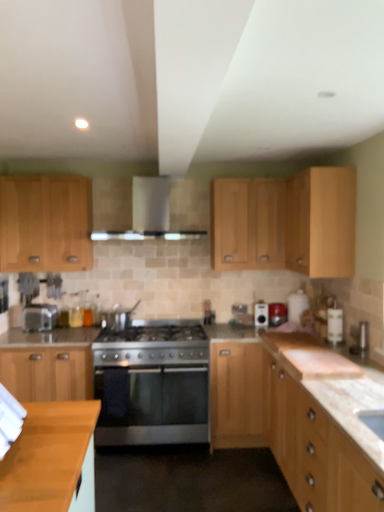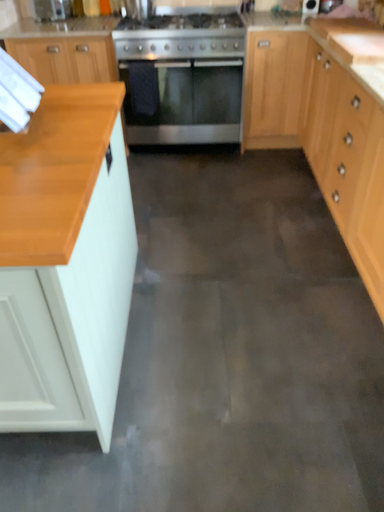
Question: How did the camera likely rotate when shooting the video?

Choices:
 (A) rotated upward
 (B) rotated downward

Answer: (B)